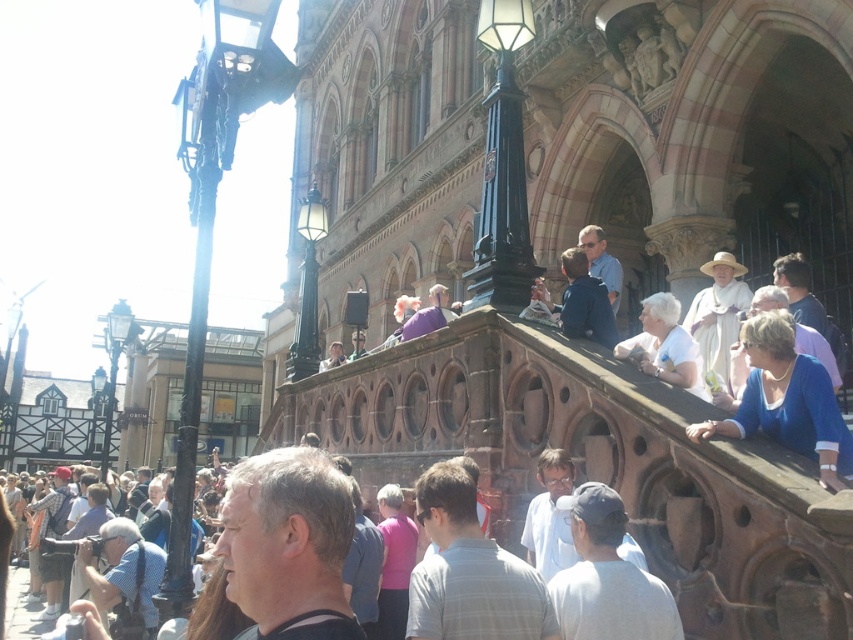
Is point (630, 627) less distant than point (398, 506)?

Yes.

Who is more forward, (x=549, y=589) or (x=410, y=525)?

Point (x=549, y=589) is more forward.

This screenshot has width=853, height=640. I want to click on gray cotton shirt at center, so click(x=607, y=577).

Is gray cotton shirt at center taller than white matte shirt at upper right?

Incorrect, gray cotton shirt at center's height is not larger of white matte shirt at upper right's.

Is point (604, 580) farther from viewer compared to point (666, 317)?

That is False.

This screenshot has width=853, height=640. Describe the element at coordinates (607, 577) in the screenshot. I see `gray cotton shirt at center` at that location.

You are a GUI agent. You are given a task and a screenshot of the screen. Output one action in this format:
    pyautogui.click(x=<x>, y=<y>)
    Task: Click on the gray cotton shirt at center
    
    Given the screenshot: What is the action you would take?
    pyautogui.click(x=607, y=577)

Between white matte shirt at upper right and pink fabric shirt at center, which one appears on the left side from the viewer's perspective?

pink fabric shirt at center

The image size is (853, 640). Describe the element at coordinates (665, 346) in the screenshot. I see `white matte shirt at upper right` at that location.

This screenshot has width=853, height=640. Identify the location of white matte shirt at upper right. (665, 346).